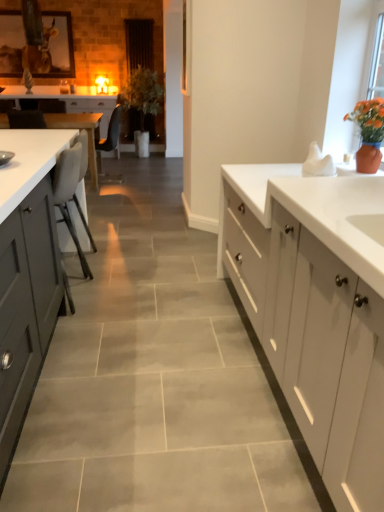
Describe the element at coordinates (94, 108) in the screenshot. I see `white matte cabinet at center, positioned as the 1th cabinetry in back-to-front order` at that location.

Image resolution: width=384 pixels, height=512 pixels. What do you see at coordinates (317, 210) in the screenshot? I see `white glossy countertop at right` at bounding box center [317, 210].

Find the location of a particular element. The width and height of the screenshot is (384, 512). white glossy table at left is located at coordinates (80, 130).

Is white matte cabinet at center, the 1th cabinetry from the top, to the left or to the right of beige fabric chair at left, the second chair in the back-to-front sequence, in the image?

white matte cabinet at center, the 1th cabinetry from the top, is positioned on beige fabric chair at left, the second chair in the back-to-front sequence,'s left side.

Is beige fabric chair at left, positioned as the 2th chair in top-to-bottom order, at the back of white matte cabinet at center, the 1th cabinetry from the top?

No, white matte cabinet at center, the 1th cabinetry from the top, is not facing the opposite direction of beige fabric chair at left, positioned as the 2th chair in top-to-bottom order.

How many degrees apart are the facing directions of white matte cabinet at center, the 1th cabinetry from the top, and beige fabric chair at left, positioned as the 2th chair in top-to-bottom order?

89.8 degrees separate the facing orientations of white matte cabinet at center, the 1th cabinetry from the top, and beige fabric chair at left, positioned as the 2th chair in top-to-bottom order.

Is white matte cabinet at center, the second cabinetry when ordered from front to back, in contact with beige fabric chair at left, acting as the first chair starting from the front?

white matte cabinet at center, the second cabinetry when ordered from front to back, and beige fabric chair at left, acting as the first chair starting from the front, are clearly separated.

Is matte gray cabinets at left, the 2th cabinetry from the back, looking in the opposite direction of green matte plant at center?

That's not correct — matte gray cabinets at left, the 2th cabinetry from the back, is not looking away from green matte plant at center.

In the scene shown: Is matte gray cabinets at left, arranged as the 2th cabinetry when viewed from the top, to the right of green matte plant at center from the viewer's perspective?

In fact, matte gray cabinets at left, arranged as the 2th cabinetry when viewed from the top, is to the left of green matte plant at center.

Is matte gray cabinets at left, which appears as the 1th cabinetry when viewed from the front, inside the boundaries of green matte plant at center, or outside?

matte gray cabinets at left, which appears as the 1th cabinetry when viewed from the front, exists outside the volume of green matte plant at center.

Considering the relative sizes of beige fabric chair at left, the second chair in the back-to-front sequence, and matte gray chair at center, marked as the first chair in a top-to-bottom arrangement, in the image provided, is beige fabric chair at left, the second chair in the back-to-front sequence, smaller than matte gray chair at center, marked as the first chair in a top-to-bottom arrangement,?

Yes.

Between beige fabric chair at left, positioned as the 2th chair in top-to-bottom order, and matte gray chair at center, which ranks as the second chair in front-to-back order, which one is positioned in front?

beige fabric chair at left, positioned as the 2th chair in top-to-bottom order, is in front.

From a real-world perspective, between beige fabric chair at left, acting as the first chair starting from the front, and matte gray chair at center, marked as the first chair in a top-to-bottom arrangement, who is vertically lower?

beige fabric chair at left, acting as the first chair starting from the front.

Can you tell me how much beige fabric chair at left, acting as the first chair starting from the front, and matte gray chair at center, marked as the first chair in a top-to-bottom arrangement, differ in facing direction?

0.134 degrees separate the facing orientations of beige fabric chair at left, acting as the first chair starting from the front, and matte gray chair at center, marked as the first chair in a top-to-bottom arrangement.

Between matte gray chair at center, placed as the second chair when sorted from bottom to top, and white glossy table at left, which one is positioned behind?

Positioned behind is matte gray chair at center, placed as the second chair when sorted from bottom to top.

Would you say matte gray chair at center, which ranks as the 1th chair in back-to-front order, is to the left or to the right of white glossy table at left in the picture?

In the image, matte gray chair at center, which ranks as the 1th chair in back-to-front order, appears on the right side of white glossy table at left.

Are matte gray chair at center, which ranks as the second chair in front-to-back order, and white glossy table at left far apart?

They are positioned close to each other.

From the image's perspective, between matte gray chair at center, marked as the first chair in a top-to-bottom arrangement, and white glossy table at left, who is located below?

white glossy table at left is shown below in the image.

Consider the image. From a real-world perspective, is beige fabric chair at left, the second chair in the back-to-front sequence, over white matte cabinet at center, positioned as the 1th cabinetry in back-to-front order?

Incorrect, from a real-world perspective, beige fabric chair at left, the second chair in the back-to-front sequence, is lower than white matte cabinet at center, positioned as the 1th cabinetry in back-to-front order.

Which is closer, (91,276) or (79,109)?

Point (91,276) appears to be closer to the viewer than point (79,109).

Are beige fabric chair at left, the second chair in the back-to-front sequence, and white matte cabinet at center, the 1th cabinetry from the top, far apart?

Yes, beige fabric chair at left, the second chair in the back-to-front sequence, and white matte cabinet at center, the 1th cabinetry from the top, are quite far apart.

Can you tell me how much white glossy countertop at right and green matte plant at center differ in facing direction?

The angle between the facing direction of white glossy countertop at right and the facing direction of green matte plant at center is 92.5 degrees.

From the image's perspective, is white glossy countertop at right below green matte plant at center?

Yes.

Is the depth of white glossy countertop at right greater than that of green matte plant at center?

That is False.

Can you see white matte cabinet at center, positioned as the 1th cabinetry in back-to-front order, touching matte gray cabinets at left, arranged as the 2th cabinetry when viewed from the top?

No, white matte cabinet at center, positioned as the 1th cabinetry in back-to-front order, is not making contact with matte gray cabinets at left, arranged as the 2th cabinetry when viewed from the top.

In the scene shown: From the image's perspective, is white matte cabinet at center, marked as the 2th cabinetry in a bottom-to-top arrangement, above matte gray cabinets at left, the 2th cabinetry from the back?

Yes, from the image's perspective, white matte cabinet at center, marked as the 2th cabinetry in a bottom-to-top arrangement, is on top of matte gray cabinets at left, the 2th cabinetry from the back.

How far apart are white matte cabinet at center, the second cabinetry when ordered from front to back, and matte gray cabinets at left, arranged as the 2th cabinetry when viewed from the top?

4.09 meters.

How different are the orientations of white matte cabinet at center, marked as the 2th cabinetry in a bottom-to-top arrangement, and matte gray cabinets at left, the 2th cabinetry from the back, in degrees?

The angle between the facing direction of white matte cabinet at center, marked as the 2th cabinetry in a bottom-to-top arrangement, and the facing direction of matte gray cabinets at left, the 2th cabinetry from the back, is 180 degrees.

This screenshot has height=512, width=384. I want to click on cabinetry positioned vertically above the beige fabric chair at left, the second chair in the back-to-front sequence (from a real-world perspective), so [x=94, y=108].

The width and height of the screenshot is (384, 512). I want to click on plant behind the matte gray cabinets at left, which appears as the 1th cabinetry when viewed from the front, so click(x=142, y=93).

Considering their positions, is white glossy table at left positioned further to beige fabric chair at left, the second chair in the back-to-front sequence, than white glossy countertop at right?

white glossy table at left lies further to beige fabric chair at left, the second chair in the back-to-front sequence, than the other object.

Estimate the real-world distances between objects in this image. Which object is closer to matte gray chair at center, which ranks as the 1th chair in back-to-front order, white matte cabinet at center, positioned as the 1th cabinetry in back-to-front order, or white glossy countertop at right?

white matte cabinet at center, positioned as the 1th cabinetry in back-to-front order.

Which object lies nearer to the anchor point white matte cabinet at center, the second cabinetry when ordered from front to back, green matte plant at center or white glossy table at left?

The object closer to white matte cabinet at center, the second cabinetry when ordered from front to back, is white glossy table at left.

Considering their positions, is white glossy table at left positioned closer to white glossy countertop at right than matte gray chair at center, which ranks as the 1th chair in back-to-front order?

white glossy table at left.

Estimate the real-world distances between objects in this image. Which object is closer to matte gray cabinets at left, which appears as the 1th cabinetry when viewed from the front, white glossy countertop at right or white matte cabinet at center, the 1th cabinetry from the top?

white glossy countertop at right is positioned closer to the anchor matte gray cabinets at left, which appears as the 1th cabinetry when viewed from the front.

From the image, which object appears to be nearer to matte gray chair at center, marked as the first chair in a top-to-bottom arrangement, beige fabric chair at left, the first chair from the bottom, or white glossy countertop at right?

beige fabric chair at left, the first chair from the bottom.

From the image, which object appears to be farther from matte gray chair at center, placed as the second chair when sorted from bottom to top, white glossy countertop at right or white glossy table at left?

Among the two, white glossy countertop at right is located further to matte gray chair at center, placed as the second chair when sorted from bottom to top.

From the image, which object appears to be farther from white glossy countertop at right, matte gray chair at center, which ranks as the second chair in front-to-back order, or green matte plant at center?

Based on the image, green matte plant at center appears to be further to white glossy countertop at right.

The image size is (384, 512). What are the coordinates of `plant positioned between matte gray chair at center, which ranks as the second chair in front-to-back order, and white matte cabinet at center, the 1th cabinetry from the top, from near to far` in the screenshot? It's located at (142, 93).

I want to click on table between white glossy countertop at right and matte gray chair at center, which ranks as the 1th chair in back-to-front order, along the z-axis, so click(80, 130).

I want to click on chair located between matte gray cabinets at left, the 2th cabinetry from the back, and matte gray chair at center, placed as the second chair when sorted from bottom to top, in the depth direction, so click(x=70, y=195).

The height and width of the screenshot is (512, 384). Identify the location of chair between beige fabric chair at left, positioned as the 2th chair in top-to-bottom order, and green matte plant at center in the front-back direction. (109, 140).